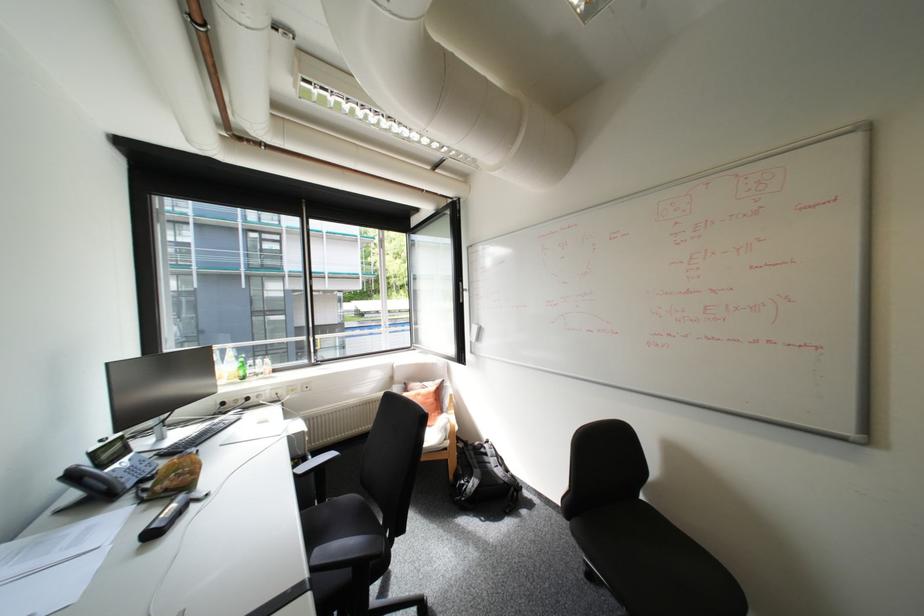
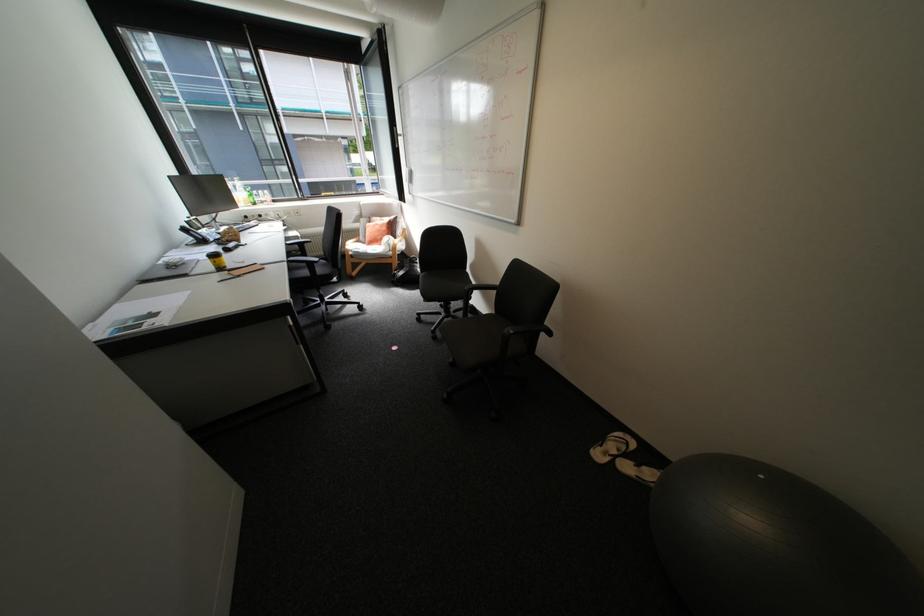
In the second image, find the point that corresponds to pixel 81 476 in the first image.

(195, 230)